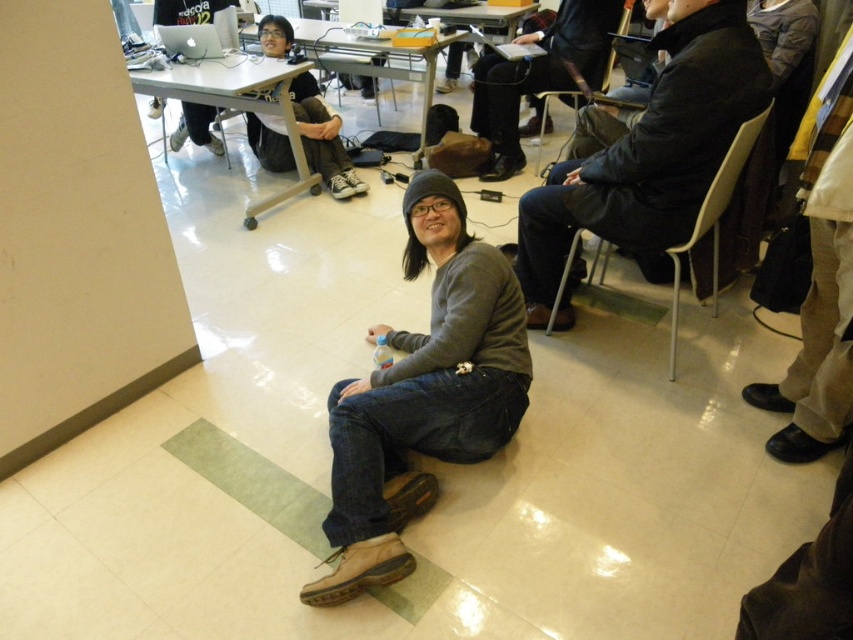
You are organizing a clothing display and need to arrange the gray matte sweater at center and the dark gray sweater at center based on their positions in the image. According to the image, which sweater should be placed to the left side of the display?

The gray matte sweater at center should be placed to the left side of the display because it is positioned to the left of the dark gray sweater at center in the image.

You are standing in the room and see both the gray matte sweater at center and the dark gray sweater at center. Which one is positioned lower in the image?

The gray matte sweater at center is positioned lower because it is located below the dark gray sweater at center.

You are standing in the meeting room and need to hand a document to the person wearing the gray matte sweater at center and the white plastic chair at right. Which one is closer to you?

The gray matte sweater at center is closer to the viewer than the white plastic chair at right, so you should hand the document to the gray matte sweater at center first since it is nearer.